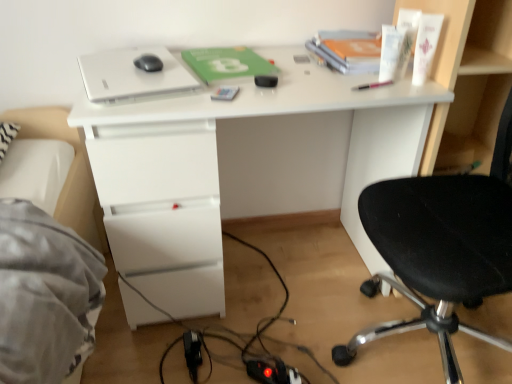
Where is `free space in front of black matte mouse at upper center`? The height and width of the screenshot is (384, 512). free space in front of black matte mouse at upper center is located at coordinates (134, 78).